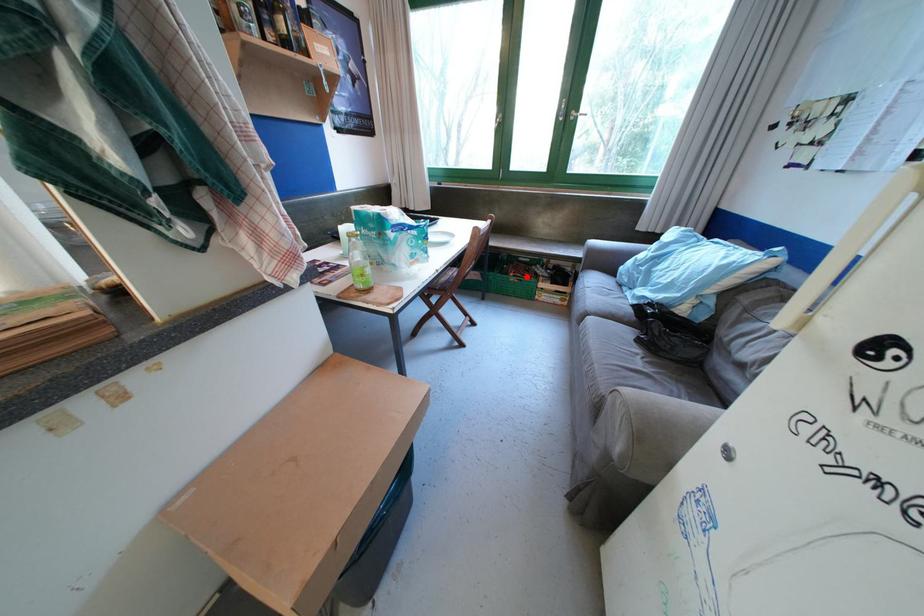
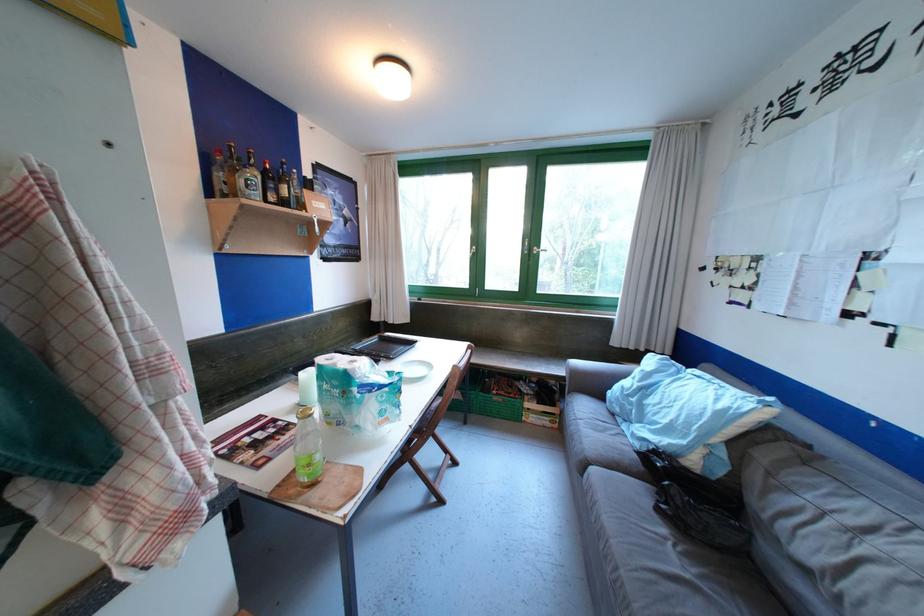
Question: I am providing you with two images of the same scene from different viewpoints. A red point is shown in image1. For the corresponding object point in image2, is it positioned nearer or farther from the camera?

Choices:
 (A) Nearer
 (B) Farther

Answer: (B)